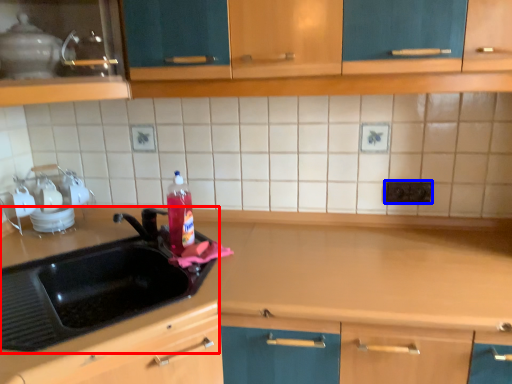
Question: Among these objects, which one is farthest to the camera, sink (highlighted by a red box) or electric outlet (highlighted by a blue box)?

Choices:
 (A) sink
 (B) electric outlet

Answer: (B)